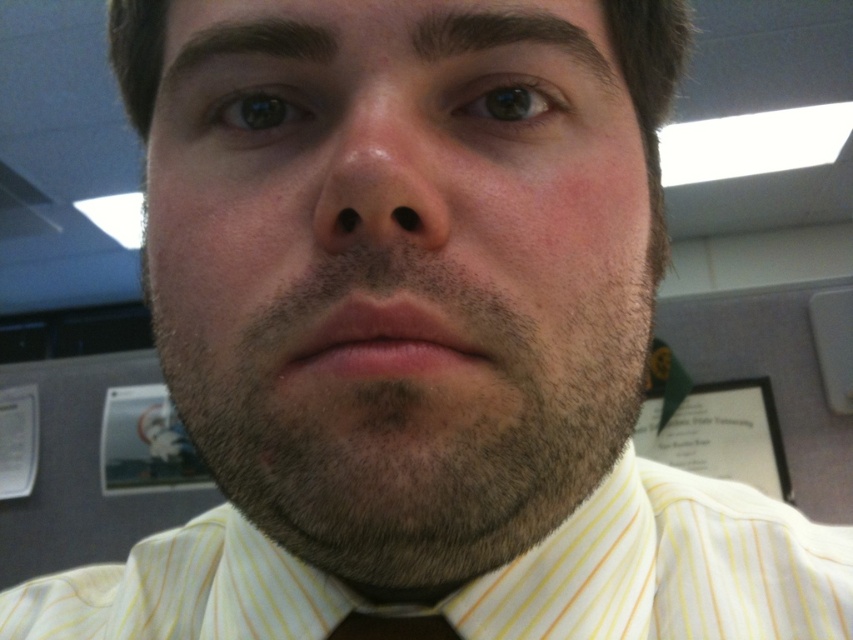
Question: Can you confirm if yellow striped shirt at center is thinner than pinkish skin nose at center?

Choices:
 (A) no
 (B) yes

Answer: (A)

Question: Which of the following is the farthest from the observer?

Choices:
 (A) (384, 202)
 (B) (271, 28)

Answer: (B)

Question: Is yellow striped shirt at center wider than white paper at right?

Choices:
 (A) no
 (B) yes

Answer: (A)

Question: Can you confirm if pinkish skin nose at center is thinner than black satin tie at center?

Choices:
 (A) yes
 (B) no

Answer: (A)

Question: Which object appears closest to the camera in this image?

Choices:
 (A) black satin tie at center
 (B) pinkish skin nose at center
 (C) smooth skin face at center
 (D) white paper at right

Answer: (B)

Question: Which object is the closest to the smooth skin face at center?

Choices:
 (A) black satin tie at center
 (B) white paper at right
 (C) pinkish skin nose at center
 (D) yellow striped shirt at center

Answer: (C)